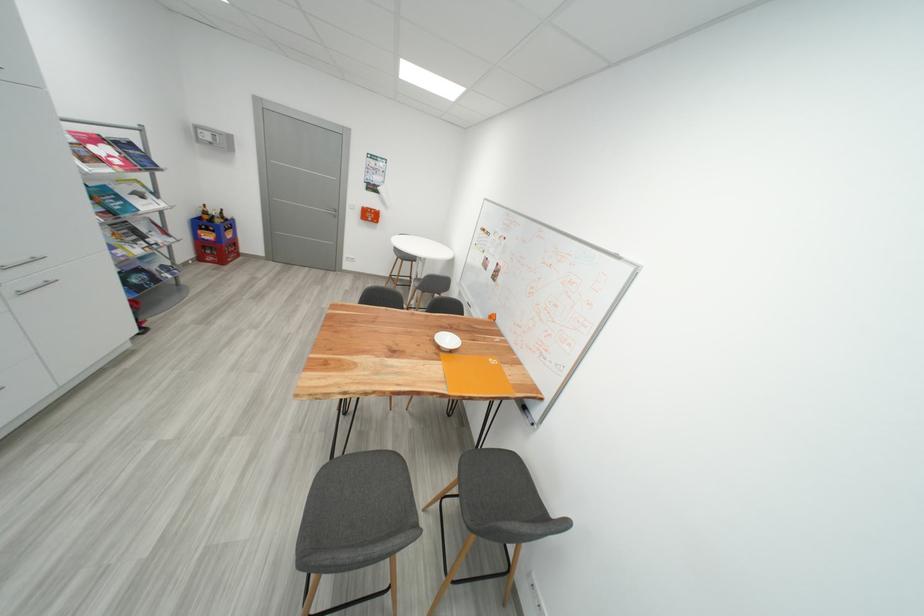
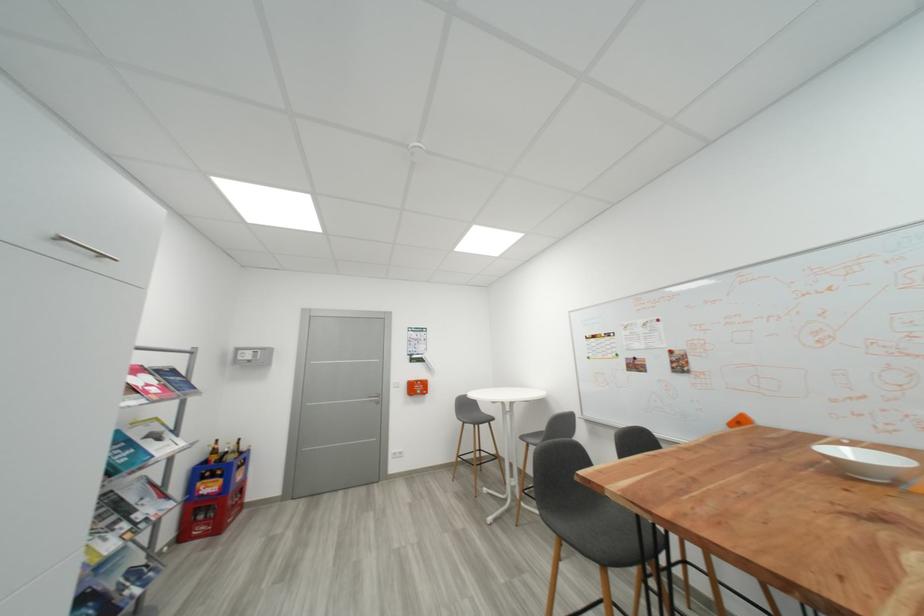
In the second image, find the point that corresponds to point (208, 261) in the first image.

(189, 538)